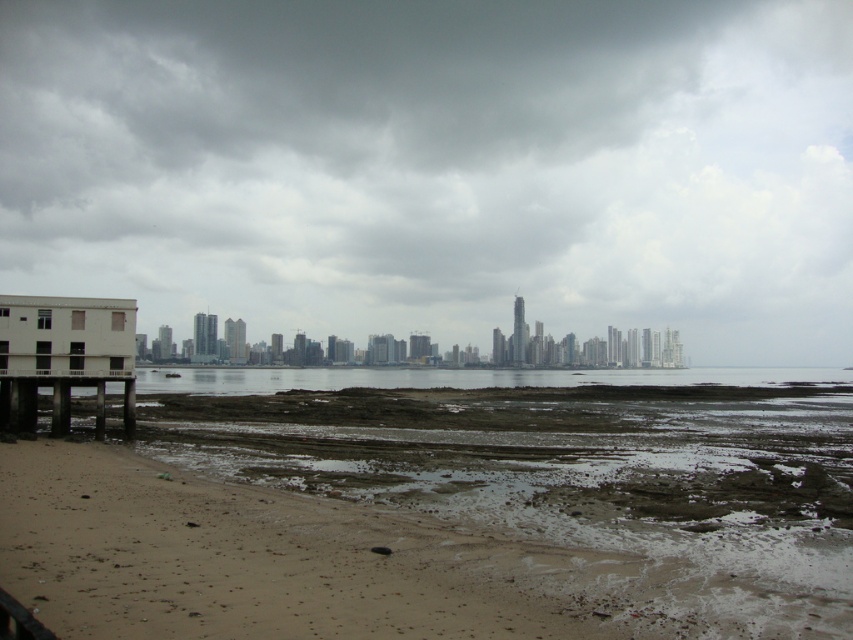
Question: Which point is farther to the camera?

Choices:
 (A) clear water at center
 (B) white concrete dock at lower left
 (C) gray cloudy sky at center

Answer: (C)

Question: Does white concrete dock at lower left have a larger size compared to clear water at center?

Choices:
 (A) no
 (B) yes

Answer: (A)

Question: Where is gray cloudy sky at center located in relation to brown sandy beach at lower left in the image?

Choices:
 (A) below
 (B) above

Answer: (B)

Question: Is brown sandy beach at lower left to the right of white concrete dock at lower left from the viewer's perspective?

Choices:
 (A) no
 (B) yes

Answer: (B)

Question: Which object is positioned closest to the gray cloudy sky at center?

Choices:
 (A) white concrete dock at lower left
 (B) brown sandy beach at lower left

Answer: (B)

Question: Which of these objects is positioned closest to the clear water at center?

Choices:
 (A) brown sandy beach at lower left
 (B) white concrete dock at lower left

Answer: (A)